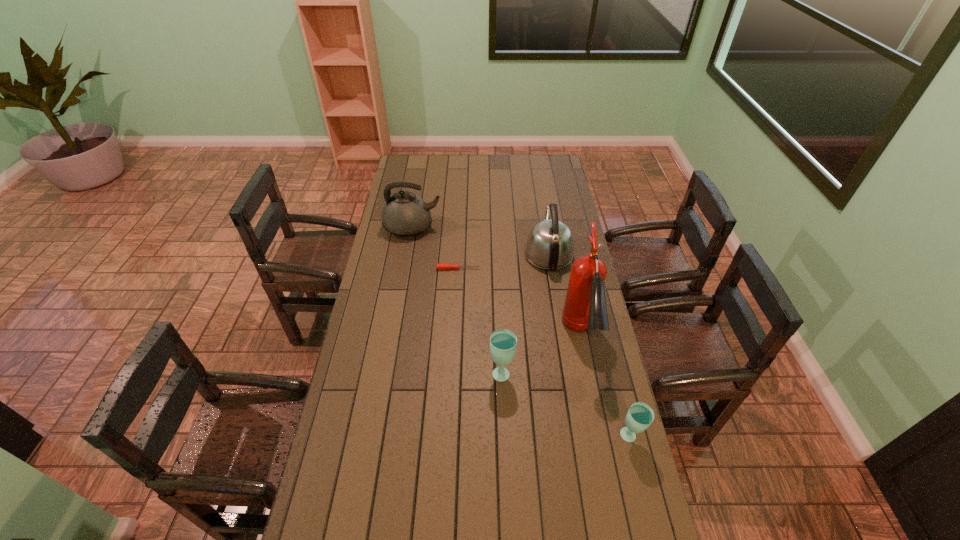
Identify the location of vacant space that is in between the left kettle and the farther glass. The height and width of the screenshot is (540, 960). (457, 300).

Locate an element on the screen. blank region between the left kettle and the farther glass is located at coordinates (457, 300).

Identify the location of free space between the fourth object from right to left and the nearest object. The width and height of the screenshot is (960, 540). tap(565, 404).

Identify the location of object that ranks as the third closest to the fire extinguisher. The width and height of the screenshot is (960, 540). (503, 342).

Select which object is the closest to the left kettle. Please provide its 2D coordinates. Your answer should be formatted as a tuple, i.e. [(x, y)], where the tuple contains the x and y coordinates of a point satisfying the conditions above.

[(439, 266)]

Identify the location of free location that satisfies the following two spatial constraints: 1. at the tip of the screwdriver; 2. on the back side of the farther glass. (453, 372).

You are a GUI agent. You are given a task and a screenshot of the screen. Output one action in this format:
    pyautogui.click(x=<x>, y=<y>)
    Task: Click on the free region that satisfies the following two spatial constraints: 1. on the back side of the second shortest object; 2. at the tip of the screwdriver
    
    Given the screenshot: What is the action you would take?
    pyautogui.click(x=588, y=268)

In order to click on vacant area in the image that satisfies the following two spatial constraints: 1. at the nozzle end of the tallest object; 2. on the left side of the right glass in this screenshot , I will do 600,437.

Where is `free space that satisfies the following two spatial constraints: 1. on the back side of the second shortest object; 2. at the spout of the left kettle`? The image size is (960, 540). free space that satisfies the following two spatial constraints: 1. on the back side of the second shortest object; 2. at the spout of the left kettle is located at coordinates pos(578,227).

Find the location of `vacant region that satisfies the following two spatial constraints: 1. at the spout of the farther glass; 2. on the right side of the left kettle`. vacant region that satisfies the following two spatial constraints: 1. at the spout of the farther glass; 2. on the right side of the left kettle is located at coordinates [388, 372].